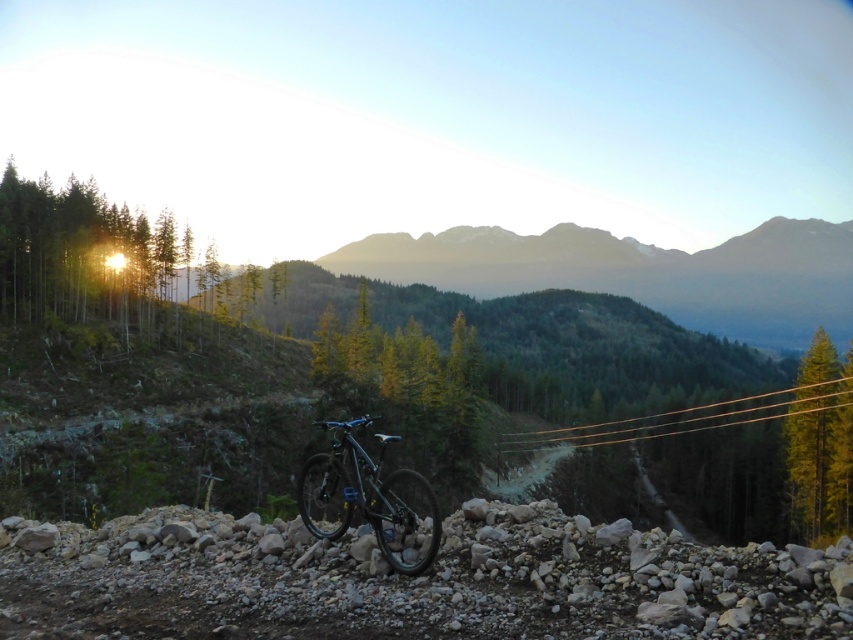
Is grayish-brown rocky mountain at center shorter than shiny blue frame at center?

Incorrect, grayish-brown rocky mountain at center's height does not fall short of shiny blue frame at center's.

Does grayish-brown rocky mountain at center appear on the left side of shiny blue frame at center?

No, grayish-brown rocky mountain at center is not to the left of shiny blue frame at center.

At what (x,y) coordinates should I click in order to perform the action: click on grayish-brown rocky mountain at center. Please return your answer as a coordinate pair (x, y). The image size is (853, 640). Looking at the image, I should click on (640, 273).

Identify the location of grayish-brown rocky mountain at center. (640, 273).

Measure the distance from shiny blue frame at center to green matte tree at right.

shiny blue frame at center is 129.56 feet away from green matte tree at right.

Is shiny blue frame at center in front of green matte tree at right?

Yes.

Is point (421, 560) positioned after point (796, 444)?

No, (421, 560) is in front of (796, 444).

At what (x,y) coordinates should I click in order to perform the action: click on shiny blue frame at center. Please return your answer as a coordinate pair (x, y). The image size is (853, 640). Looking at the image, I should click on (369, 499).

Can you confirm if grayish-brown rocky mountain at center is positioned to the left of smooth dirt trail at center?

Incorrect, grayish-brown rocky mountain at center is not on the left side of smooth dirt trail at center.

Can you confirm if grayish-brown rocky mountain at center is shorter than smooth dirt trail at center?

In fact, grayish-brown rocky mountain at center may be taller than smooth dirt trail at center.

The image size is (853, 640). Describe the element at coordinates (640, 273) in the screenshot. I see `grayish-brown rocky mountain at center` at that location.

Where is `grayish-brown rocky mountain at center`? grayish-brown rocky mountain at center is located at coordinates (640, 273).